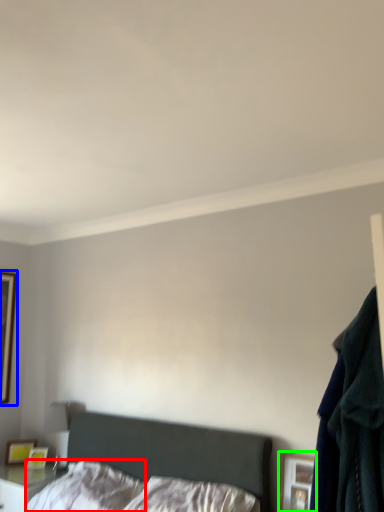
Question: Which object is the closest to the pillow (highlighted by a red box)? Choose among these: picture frame (highlighted by a blue box) or picture frame (highlighted by a green box).

Choices:
 (A) picture frame
 (B) picture frame

Answer: (B)